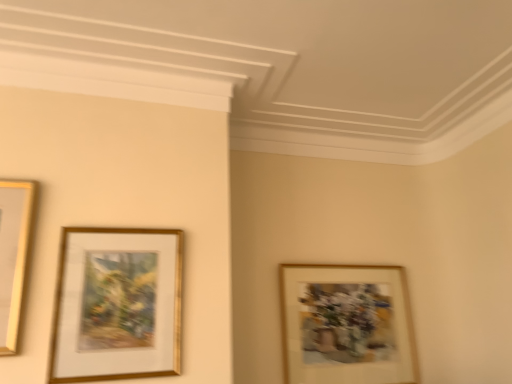
Find the location of a particular element. This screenshot has height=384, width=512. gold/glossy picture frame at lower left, the 2th picture frame in the back-to-front sequence is located at coordinates (117, 305).

What do you see at coordinates (117, 305) in the screenshot? I see `gold/glossy picture frame at lower left, the 1th picture frame from the front` at bounding box center [117, 305].

What do you see at coordinates (347, 325) in the screenshot?
I see `wooden picture frame at lower right, the 2th picture frame from the left` at bounding box center [347, 325].

Where is `wooden picture frame at lower right, placed as the first picture frame when sorted from back to front`? This screenshot has height=384, width=512. wooden picture frame at lower right, placed as the first picture frame when sorted from back to front is located at coordinates tap(347, 325).

What is the approximate height of wooden picture frame at lower right, positioned as the 1th picture frame in right-to-left order?

It is 22.48 inches.

The width and height of the screenshot is (512, 384). Find the location of `gold/glossy picture frame at lower left, which is the first picture frame in left-to-right order`. gold/glossy picture frame at lower left, which is the first picture frame in left-to-right order is located at coordinates (117, 305).

Is wooden picture frame at lower right, positioned as the 1th picture frame in right-to-left order, to the left of gold/glossy picture frame at lower left, the 2th picture frame from the right, from the viewer's perspective?

No.

Between wooden picture frame at lower right, placed as the first picture frame when sorted from back to front, and gold/glossy picture frame at lower left, the 1th picture frame from the front, which one is positioned behind?

wooden picture frame at lower right, placed as the first picture frame when sorted from back to front, is behind.

Which is behind, point (345, 268) or point (141, 323)?

Positioned behind is point (345, 268).

From the image's perspective, which one is positioned lower, wooden picture frame at lower right, positioned as the 1th picture frame in right-to-left order, or gold/glossy picture frame at lower left, the 1th picture frame from the front?

wooden picture frame at lower right, positioned as the 1th picture frame in right-to-left order, from the image's perspective.

From a real-world perspective, is wooden picture frame at lower right, the 2th picture frame from the left, below gold/glossy picture frame at lower left, the 2th picture frame in the back-to-front sequence?

Indeed, from a real-world perspective, wooden picture frame at lower right, the 2th picture frame from the left, is positioned beneath gold/glossy picture frame at lower left, the 2th picture frame in the back-to-front sequence.

Considering the sizes of wooden picture frame at lower right, positioned as the 1th picture frame in right-to-left order, and gold/glossy picture frame at lower left, which is the first picture frame in left-to-right order, in the image, is wooden picture frame at lower right, positioned as the 1th picture frame in right-to-left order, wider or thinner than gold/glossy picture frame at lower left, which is the first picture frame in left-to-right order,?

Considering their sizes, wooden picture frame at lower right, positioned as the 1th picture frame in right-to-left order, looks broader than gold/glossy picture frame at lower left, which is the first picture frame in left-to-right order.

Between wooden picture frame at lower right, placed as the first picture frame when sorted from back to front, and gold/glossy picture frame at lower left, the 1th picture frame from the front, which one has less height?

Standing shorter between the two is gold/glossy picture frame at lower left, the 1th picture frame from the front.

Based on their sizes in the image, would you say wooden picture frame at lower right, which appears as the 2th picture frame when viewed from the front, is bigger or smaller than gold/glossy picture frame at lower left, the 2th picture frame in the back-to-front sequence?

wooden picture frame at lower right, which appears as the 2th picture frame when viewed from the front, is bigger than gold/glossy picture frame at lower left, the 2th picture frame in the back-to-front sequence.

Does wooden picture frame at lower right, which appears as the 2th picture frame when viewed from the front, contain gold/glossy picture frame at lower left, the 2th picture frame in the back-to-front sequence?

No, wooden picture frame at lower right, which appears as the 2th picture frame when viewed from the front, does not contain gold/glossy picture frame at lower left, the 2th picture frame in the back-to-front sequence.

In the scene shown: Would you consider wooden picture frame at lower right, the 2th picture frame from the left, to be distant from gold/glossy picture frame at lower left, which is the first picture frame in left-to-right order?

No, wooden picture frame at lower right, the 2th picture frame from the left, is not far from gold/glossy picture frame at lower left, which is the first picture frame in left-to-right order.

Is gold/glossy picture frame at lower left, the 1th picture frame from the front, at the back of wooden picture frame at lower right, placed as the first picture frame when sorted from back to front?

wooden picture frame at lower right, placed as the first picture frame when sorted from back to front, is not turned away from gold/glossy picture frame at lower left, the 1th picture frame from the front.

How far apart are wooden picture frame at lower right, which appears as the 2th picture frame when viewed from the front, and gold/glossy picture frame at lower left, the 1th picture frame from the front?

32.27 inches.

Identify the location of picture frame that is behind the gold/glossy picture frame at lower left, the 1th picture frame from the front. The width and height of the screenshot is (512, 384). (347, 325).

Based on their positions, is gold/glossy picture frame at lower left, the 2th picture frame from the right, located to the left or right of wooden picture frame at lower right, the 2th picture frame from the left?

gold/glossy picture frame at lower left, the 2th picture frame from the right, is to the left of wooden picture frame at lower right, the 2th picture frame from the left.

Considering the relative positions of gold/glossy picture frame at lower left, the 2th picture frame in the back-to-front sequence, and wooden picture frame at lower right, which appears as the 2th picture frame when viewed from the front, in the image provided, is gold/glossy picture frame at lower left, the 2th picture frame in the back-to-front sequence, behind wooden picture frame at lower right, which appears as the 2th picture frame when viewed from the front,?

That is False.

Between point (148, 336) and point (380, 268), which one is positioned in front?

The point (148, 336) is more forward.

From the image's perspective, relative to wooden picture frame at lower right, placed as the first picture frame when sorted from back to front, is gold/glossy picture frame at lower left, the 2th picture frame from the right, above or below?

gold/glossy picture frame at lower left, the 2th picture frame from the right, is situated higher than wooden picture frame at lower right, placed as the first picture frame when sorted from back to front, in the image.

From a real-world perspective, is gold/glossy picture frame at lower left, the 2th picture frame in the back-to-front sequence, physically located above or below wooden picture frame at lower right, the 2th picture frame from the left?

gold/glossy picture frame at lower left, the 2th picture frame in the back-to-front sequence, is above wooden picture frame at lower right, the 2th picture frame from the left.

Is gold/glossy picture frame at lower left, which is the first picture frame in left-to-right order, wider or thinner than wooden picture frame at lower right, the 2th picture frame from the left?

gold/glossy picture frame at lower left, which is the first picture frame in left-to-right order, is thinner than wooden picture frame at lower right, the 2th picture frame from the left.

Which of these two, gold/glossy picture frame at lower left, which is the first picture frame in left-to-right order, or wooden picture frame at lower right, the 2th picture frame from the left, stands taller?

wooden picture frame at lower right, the 2th picture frame from the left, is taller.

Which of these two, gold/glossy picture frame at lower left, the 2th picture frame in the back-to-front sequence, or wooden picture frame at lower right, the 2th picture frame from the left, is bigger?

With larger size is wooden picture frame at lower right, the 2th picture frame from the left.

Is gold/glossy picture frame at lower left, the 2th picture frame from the right, located outside wooden picture frame at lower right, placed as the first picture frame when sorted from back to front?

Yes, gold/glossy picture frame at lower left, the 2th picture frame from the right, is located beyond the bounds of wooden picture frame at lower right, placed as the first picture frame when sorted from back to front.

Are gold/glossy picture frame at lower left, the 2th picture frame in the back-to-front sequence, and wooden picture frame at lower right, which appears as the 2th picture frame when viewed from the front, located far from each other?

gold/glossy picture frame at lower left, the 2th picture frame in the back-to-front sequence, is near wooden picture frame at lower right, which appears as the 2th picture frame when viewed from the front, not far away.

Is wooden picture frame at lower right, the 2th picture frame from the left, at the back of gold/glossy picture frame at lower left, the 2th picture frame in the back-to-front sequence?

No.

Can you tell me how much gold/glossy picture frame at lower left, the 2th picture frame from the right, and wooden picture frame at lower right, positioned as the 1th picture frame in right-to-left order, differ in facing direction?

0.00175 degrees.

How far apart are gold/glossy picture frame at lower left, the 2th picture frame in the back-to-front sequence, and wooden picture frame at lower right, which appears as the 2th picture frame when viewed from the front?

81.97 centimeters.

Identify the location of picture frame that is on the left side of wooden picture frame at lower right, which appears as the 2th picture frame when viewed from the front. This screenshot has height=384, width=512. (117, 305).

At what (x,y) coordinates should I click in order to perform the action: click on picture frame that appears above the wooden picture frame at lower right, positioned as the 1th picture frame in right-to-left order (from a real-world perspective). Please return your answer as a coordinate pair (x, y). Looking at the image, I should click on (117, 305).

At what (x,y) coordinates should I click in order to perform the action: click on picture frame located behind the gold/glossy picture frame at lower left, the 2th picture frame from the right. Please return your answer as a coordinate pair (x, y). The height and width of the screenshot is (384, 512). Looking at the image, I should click on (347, 325).